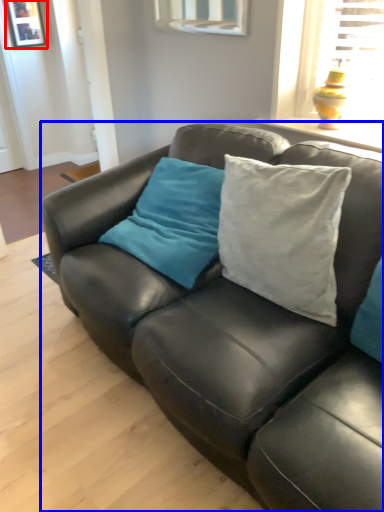
Question: Among these objects, which one is nearest to the camera, picture frame (highlighted by a red box) or studio couch (highlighted by a blue box)?

Choices:
 (A) picture frame
 (B) studio couch

Answer: (B)